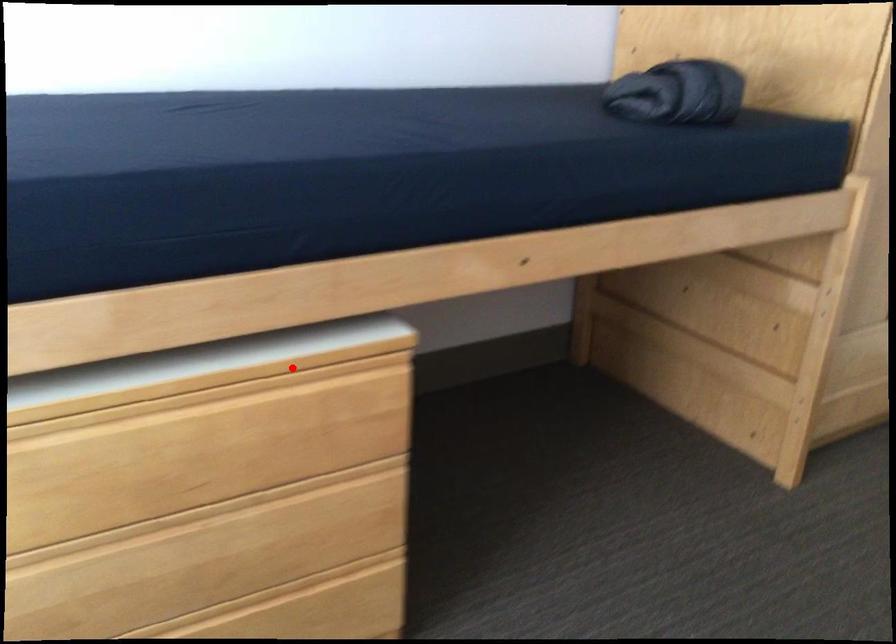
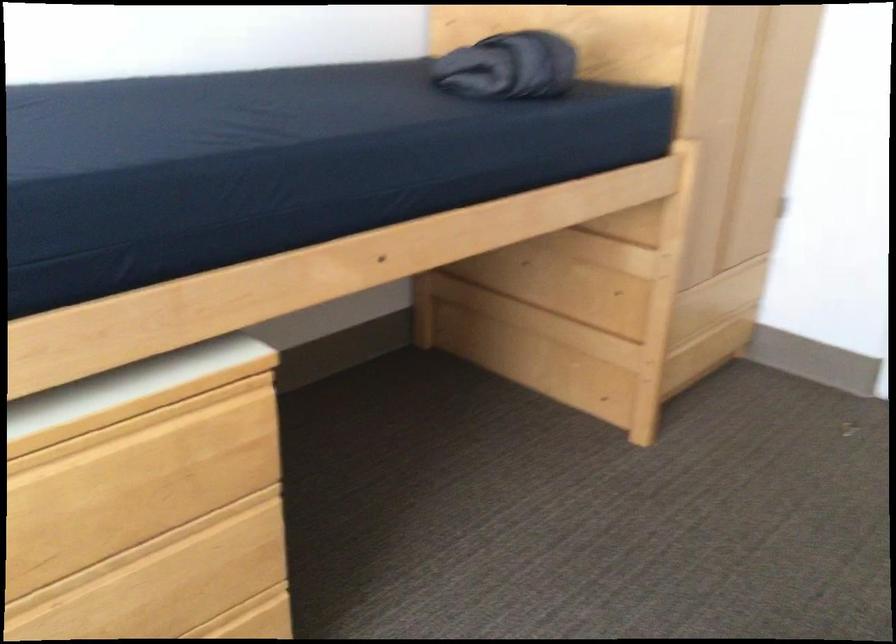
Find the pixel in the second image that matches the highlighted location in the first image.

(133, 413)